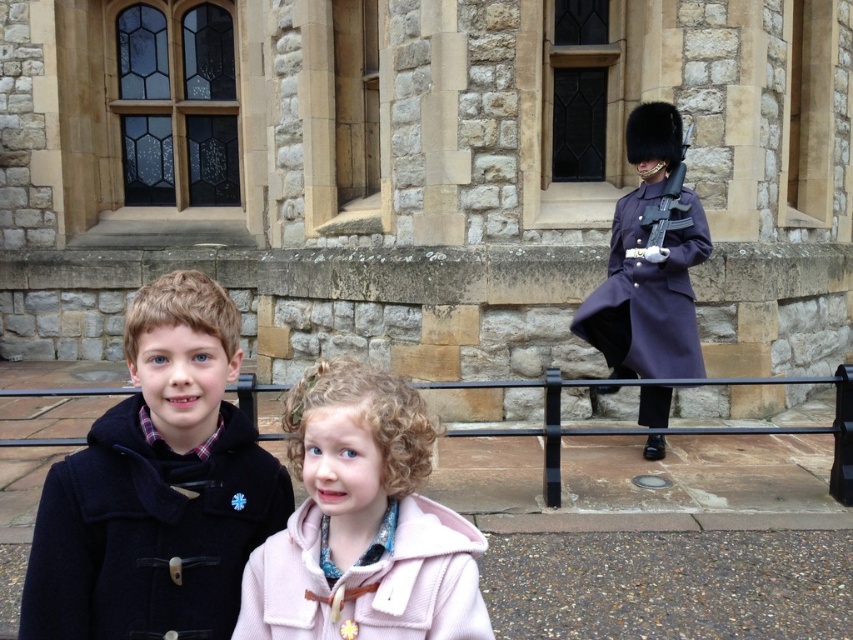
Is dark blue wool coat at center further to the viewer compared to purple woolen coat at right?

No, dark blue wool coat at center is in front of purple woolen coat at right.

Can you confirm if dark blue wool coat at center is wider than purple woolen coat at right?

In fact, dark blue wool coat at center might be narrower than purple woolen coat at right.

Is point (213, 609) closer to viewer compared to point (701, 216)?

Yes, it is.

Image resolution: width=853 pixels, height=640 pixels. Find the location of `dark blue wool coat at center`. dark blue wool coat at center is located at coordinates (157, 486).

Who is shorter, dark blue wool coat at center or black metal balustrade at lower center?

black metal balustrade at lower center

Does dark blue wool coat at center have a greater width compared to black metal balustrade at lower center?

Correct, the width of dark blue wool coat at center exceeds that of black metal balustrade at lower center.

Does point (47, 611) lie in front of point (456, 433)?

Yes.

Where is `dark blue wool coat at center`? The image size is (853, 640). dark blue wool coat at center is located at coordinates (157, 486).

Who is positioned more to the left, purple woolen coat at right or black metal balustrade at lower center?

Positioned to the left is purple woolen coat at right.

Can you confirm if purple woolen coat at right is positioned to the left of black metal balustrade at lower center?

Indeed, purple woolen coat at right is positioned on the left side of black metal balustrade at lower center.

Which is behind, point (602, 285) or point (553, 394)?

Point (602, 285)

Locate an element on the screen. This screenshot has height=640, width=853. purple woolen coat at right is located at coordinates click(x=650, y=260).